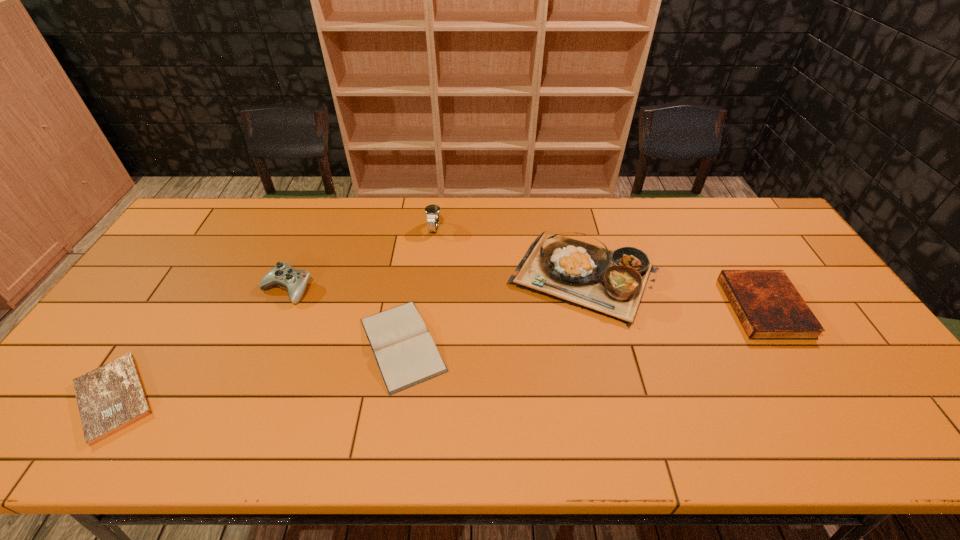
The image size is (960, 540). In order to click on watch in this screenshot , I will do `click(432, 211)`.

This screenshot has height=540, width=960. I want to click on platter, so click(611, 283).

The image size is (960, 540). I want to click on control, so click(293, 280).

Find the location of a particular element. This screenshot has height=540, width=960. the second object from left to right is located at coordinates (293, 280).

The height and width of the screenshot is (540, 960). I want to click on the tallest Bible, so click(x=769, y=307).

I want to click on the fourth tallest object, so click(769, 307).

Where is `the second Bible from right to left`? This screenshot has width=960, height=540. the second Bible from right to left is located at coordinates (405, 352).

The height and width of the screenshot is (540, 960). What are the coordinates of `the second shortest object` in the screenshot? It's located at (405, 352).

What are the coordinates of `the shortest Bible` in the screenshot? It's located at (111, 397).

Identify the location of the shortest object. (111, 397).